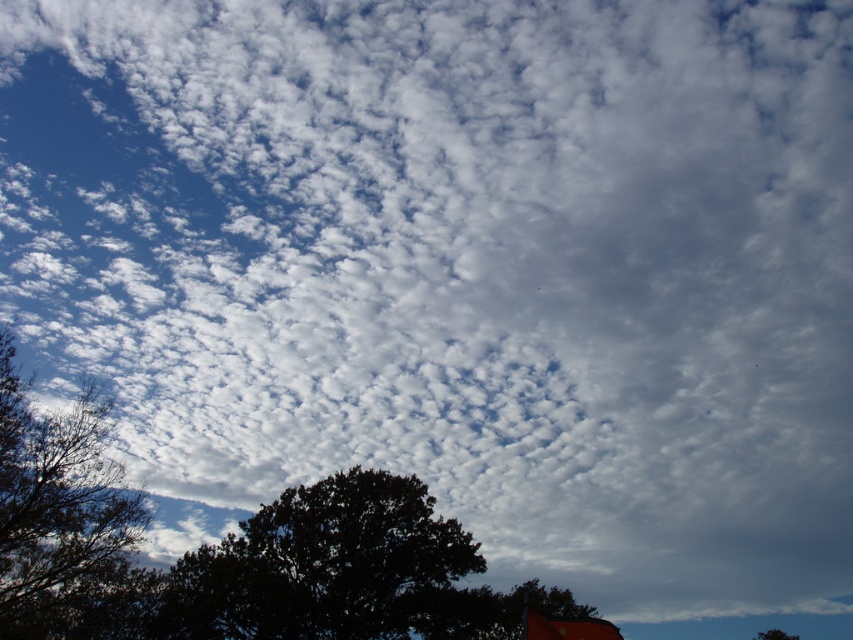
You are a bird flying at an altitude of 50 meters. You spot the dark green leafy tree at left and the dark green leafy tree at bottom. Can you land on both trees without descending below your current altitude?

The distance between the dark green leafy tree at left and the dark green leafy tree at bottom is 51.10 meters. Since you are flying at 50 meters, you would need to descend slightly to reach both trees, as the vertical distance between them exceeds your current altitude. Therefore, you cannot land on both without descending below 50 meters.

You are standing in a field looking at the sky with the dark green leafy tree at left. A bird is flying towards the point marked at coordinates (64,518). Will the bird reach the dark green leafy tree at left?

The point at coordinates (64,518) corresponds to the dark green leafy tree at left, so yes, the bird flying towards that point will reach the dark green leafy tree at left.

You are standing in a field and want to fly a kite. You see an orange fabric flag at lower right and a dark green leafy tree at bottom. If you fly your kite between them, will it be possible to keep the kite between both objects without it going beyond their combined horizontal span?

The orange fabric flag at lower right and dark green leafy tree at bottom are 46.02 meters apart. Since the kite can be flown within this distance, it is possible to keep the kite between both objects without it going beyond their combined horizontal span.